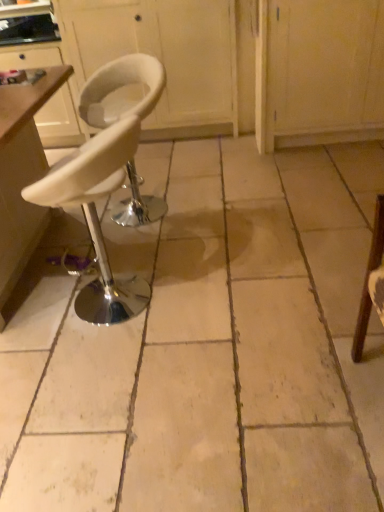
Question: In terms of size, does white plastic table at left appear bigger or smaller than white leather stool at center?

Choices:
 (A) small
 (B) big

Answer: (B)

Question: Relative to white leather stool at center, is white plastic table at left in front or behind?

Choices:
 (A) behind
 (B) front

Answer: (A)

Question: Which is nearer to the white leather stool at center?

Choices:
 (A) white matte stool at center, the second chair in the front-to-back sequence
 (B) white matte cabinet at upper center
 (C) white matte stool at left, the second chair in the back-to-front sequence
 (D) white plastic table at left

Answer: (C)

Question: Considering the real-world distances, which object is farthest from the white matte cabinet at upper center?

Choices:
 (A) white matte stool at center, the second chair in the front-to-back sequence
 (B) white matte stool at left, the first chair in the front-to-back sequence
 (C) white plastic table at left
 (D) white leather stool at center

Answer: (D)